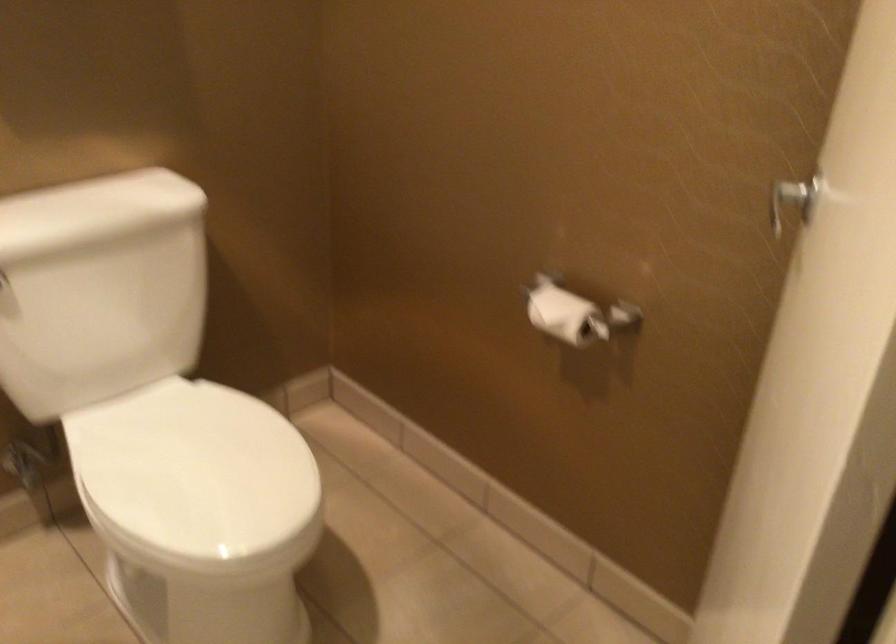
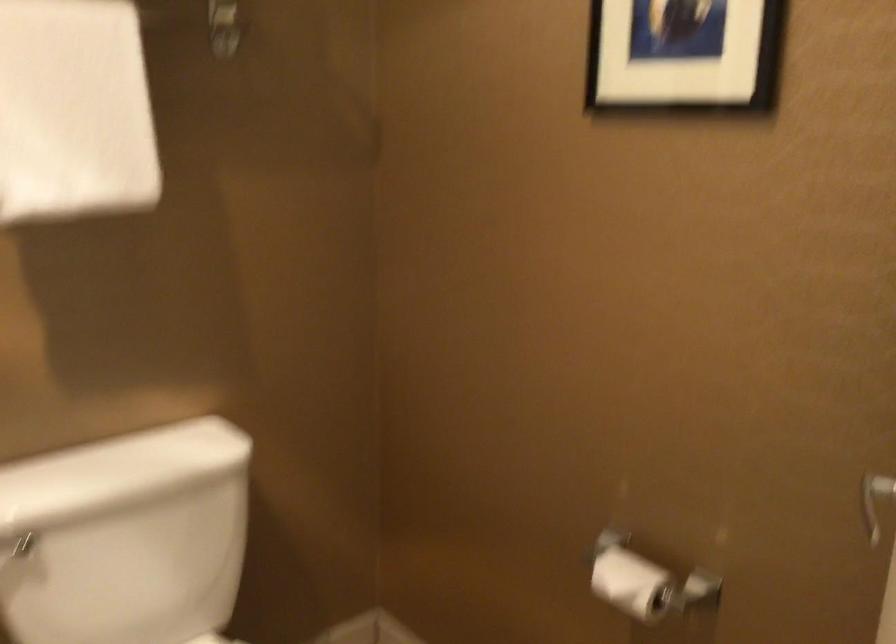
Question: In a continuous first-person perspective shot, in which direction is the camera moving?

Choices:
 (A) Left
 (B) Right
 (C) Forward
 (D) Backward

Answer: (C)